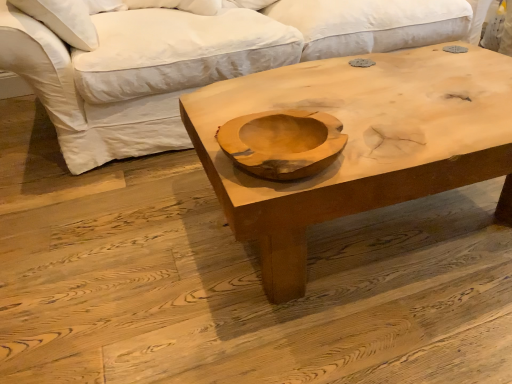
Question: Considering the relative sizes of white cotton studio couch at upper center and natural wood coffee table at center in the image provided, is white cotton studio couch at upper center bigger than natural wood coffee table at center?

Choices:
 (A) yes
 (B) no

Answer: (A)

Question: Is white cotton studio couch at upper center not near natural wood coffee table at center?

Choices:
 (A) yes
 (B) no

Answer: (B)

Question: Is white cotton studio couch at upper center oriented away from natural wood coffee table at center?

Choices:
 (A) yes
 (B) no

Answer: (B)

Question: Does white cotton studio couch at upper center have a smaller size compared to natural wood coffee table at center?

Choices:
 (A) no
 (B) yes

Answer: (A)

Question: Is white cotton studio couch at upper center located outside natural wood coffee table at center?

Choices:
 (A) no
 (B) yes

Answer: (B)

Question: Is natural wood coffee table at center surrounded by white cotton studio couch at upper center?

Choices:
 (A) yes
 (B) no

Answer: (B)

Question: Considering the relative sizes of natural wood coffee table at center and white cotton studio couch at upper center in the image provided, is natural wood coffee table at center shorter than white cotton studio couch at upper center?

Choices:
 (A) yes
 (B) no

Answer: (A)

Question: From the image's perspective, is natural wood coffee table at center above white cotton studio couch at upper center?

Choices:
 (A) yes
 (B) no

Answer: (B)

Question: Does natural wood coffee table at center have a smaller size compared to white cotton studio couch at upper center?

Choices:
 (A) yes
 (B) no

Answer: (A)

Question: Is natural wood coffee table at center not within white cotton studio couch at upper center?

Choices:
 (A) yes
 (B) no

Answer: (A)

Question: From the image's perspective, does natural wood coffee table at center appear lower than white cotton studio couch at upper center?

Choices:
 (A) no
 (B) yes

Answer: (B)

Question: Is white cotton studio couch at upper center surrounded by natural wood coffee table at center?

Choices:
 (A) no
 (B) yes

Answer: (A)

Question: Considering the positions of natural wood coffee table at center and white cotton studio couch at upper center in the image, is natural wood coffee table at center taller or shorter than white cotton studio couch at upper center?

Choices:
 (A) tall
 (B) short

Answer: (B)